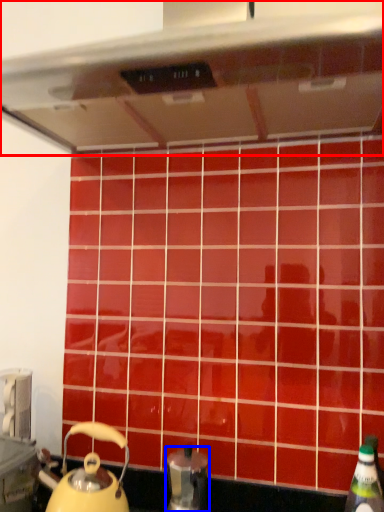
Question: Which of the following is the closest to the observer, exhaust hood (highlighted by a red box) or kitchen appliance (highlighted by a blue box)?

Choices:
 (A) exhaust hood
 (B) kitchen appliance

Answer: (A)